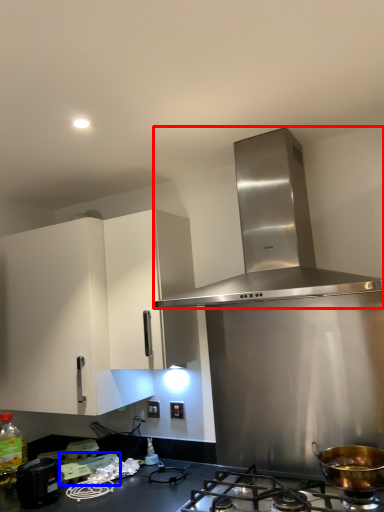
Question: Which object appears farthest to the camera in this image, home appliance (highlighted by a red box) or appliance (highlighted by a blue box)?

Choices:
 (A) home appliance
 (B) appliance

Answer: (B)